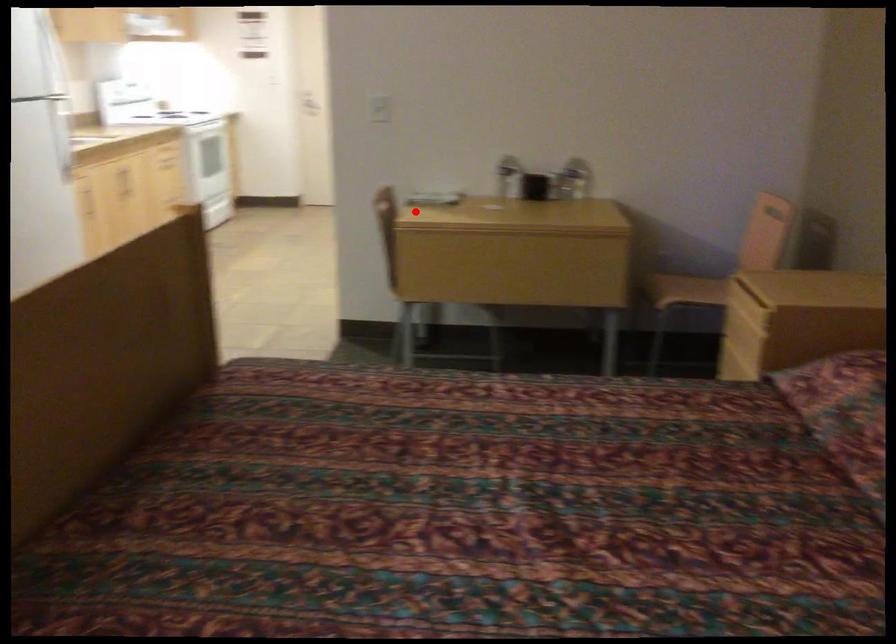
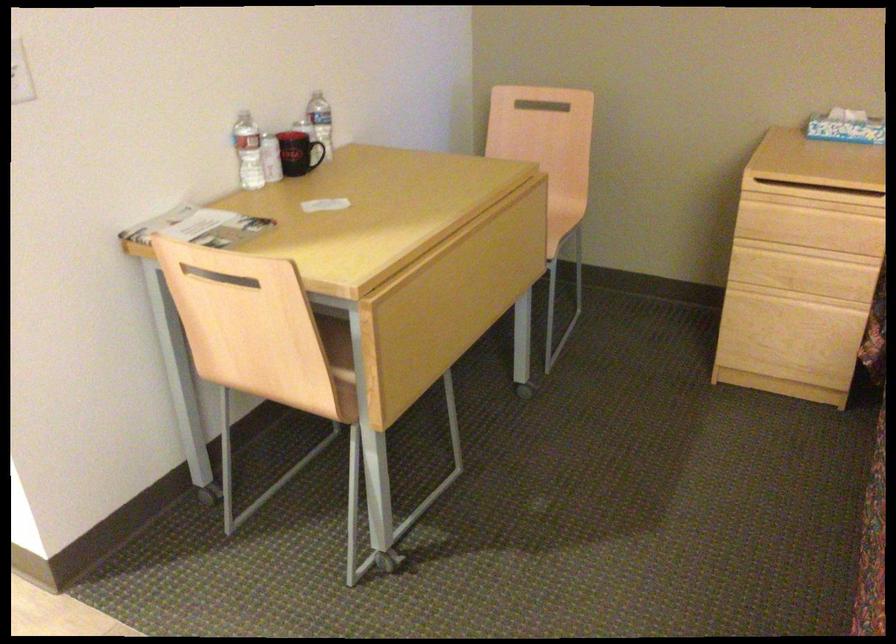
The point at the highlighted location is marked in the first image. Where is the corresponding point in the second image?

(220, 277)